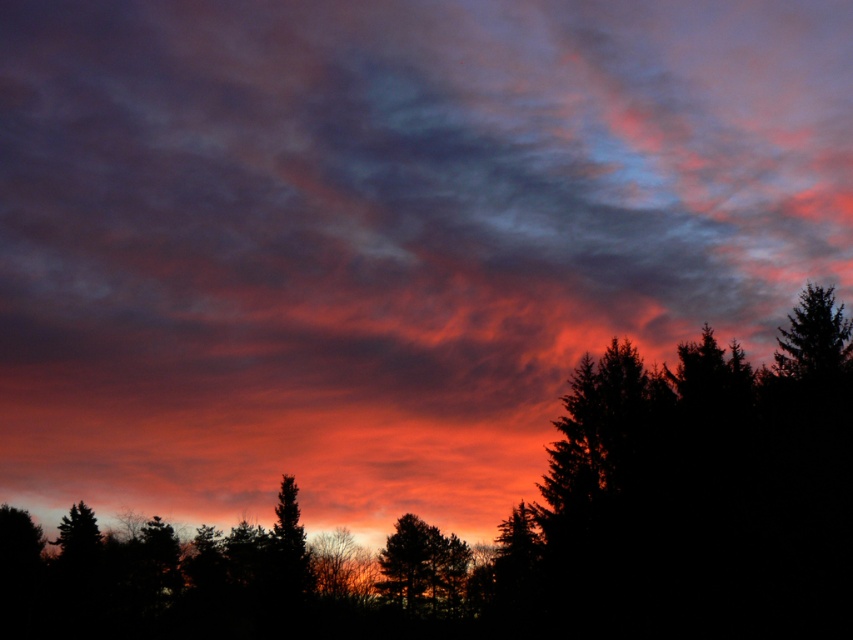
Question: Which is nearer to the silhouette evergreen tree at right?

Choices:
 (A) silhouette trees at center
 (B) silhouette tree at center

Answer: (A)

Question: Which object is farther from the camera taking this photo?

Choices:
 (A) silhouette trees at center
 (B) silhouette evergreen tree at right

Answer: (A)

Question: Is silhouette trees at center behind silhouette evergreen tree at right?

Choices:
 (A) no
 (B) yes

Answer: (B)

Question: Based on their relative distances, which object is nearer to the silhouette tree at center?

Choices:
 (A) silhouette trees at center
 (B) silhouette evergreen tree at right

Answer: (A)

Question: Is silhouette trees at center below silhouette evergreen tree at right?

Choices:
 (A) no
 (B) yes

Answer: (B)

Question: Does silhouette trees at center have a greater width compared to silhouette tree at center?

Choices:
 (A) yes
 (B) no

Answer: (A)